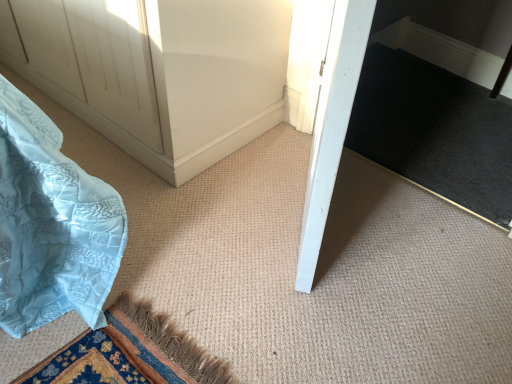
Locate an element on the screen. This screenshot has height=384, width=512. vacant space underneath white smooth door at center (from a real-world perspective) is located at coordinates (289, 218).